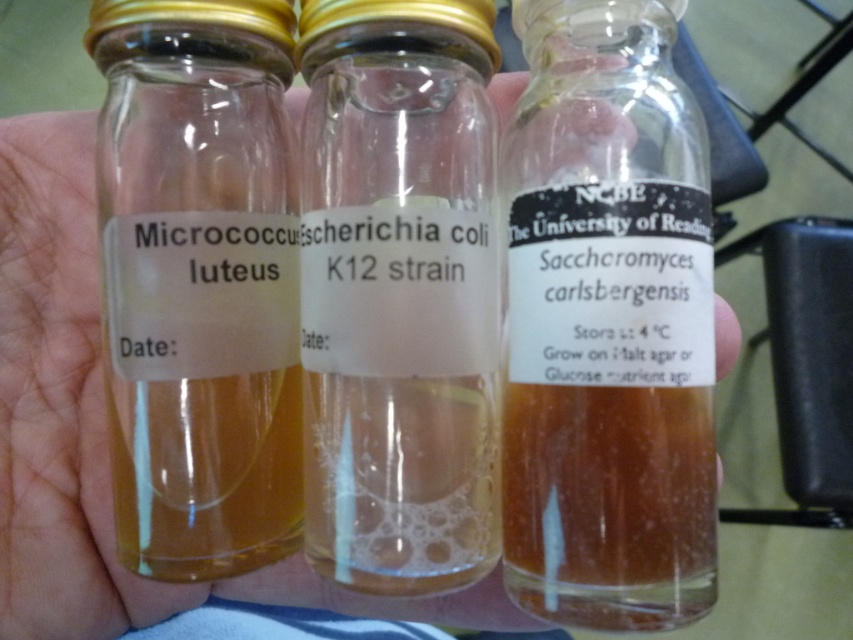
You are a lab technician holding three glass vials in your hand. You need to place them on a shelf. The shelf has a small indentation at the back that can only hold items placed directly behind the front edge. The transparent glass bottle at center and the translucent glass bottle at left are among the vials. Which bottle should you place first to ensure it fits into the indentation?

The translucent glass bottle at left should be placed first because the transparent glass bottle at center is positioned under it, meaning the translucent one is closer to the front. Placing it first ensures it can be positioned directly over the indentation.

You are a lab technician trying to locate the transparent glass bottle at center. According to the image, where is it positioned in terms of coordinates?

The transparent glass bottle at center is located at point [607,324].